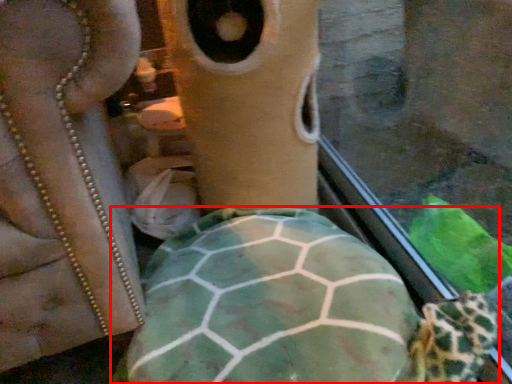
Question: Where is tortoise (annotated by the red box) located in relation to face in the image?

Choices:
 (A) right
 (B) left

Answer: (B)